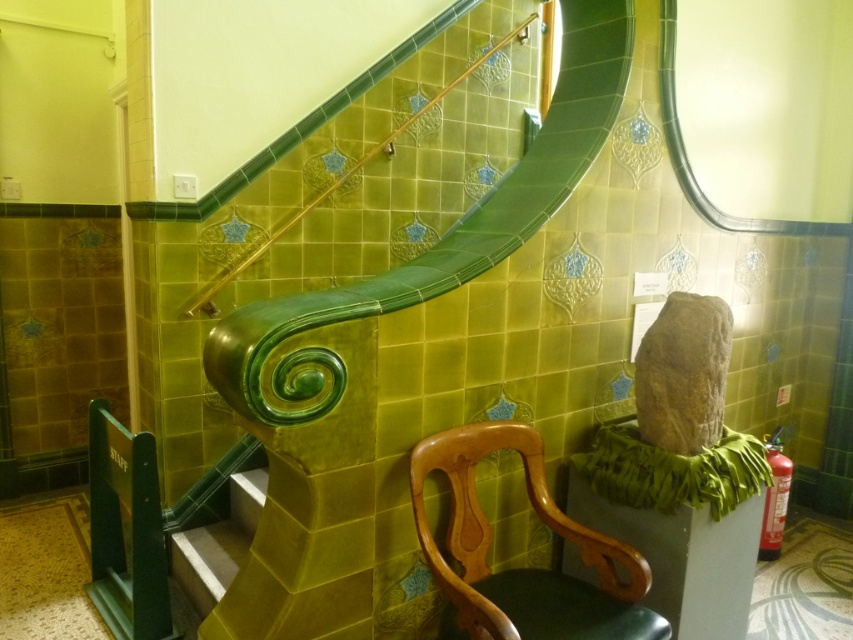
In the scene shown: You are a painter standing at the bottom of the staircase. You need to paint the wooden chair at center and the green glossy stair at lower center. Which object requires you to reach higher to paint?

The wooden chair at center requires reaching higher to paint because it is taller than the green glossy stair at lower center.

You are moving a wooden chair into a room with a staircase. The wooden chair at center needs to fit through a doorway adjacent to the green glossy stair at lower center. Can the chair pass through the doorway if the doorway is the same width as the stair?

The wooden chair at center is wider than the green glossy stair at lower center, so it cannot pass through a doorway that is the same width as the stair.

You are standing at the bottom of the staircase and want to sit down on the wooden chair. Which direction should you move to reach the wooden chair at center from the green glossy stair at lower center?

The wooden chair at center is to the right of the green glossy stair at lower center, so you should move to your right to reach it.